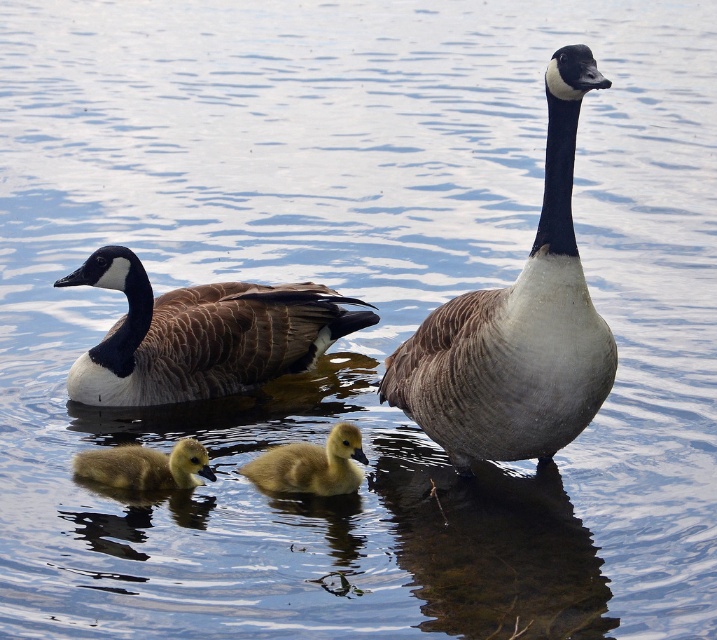
Question: Among these objects, which one is farthest from the camera?

Choices:
 (A) brown feathered goose at left
 (B) golden downy duckling at center
 (C) golden downy duckling at lower left

Answer: (A)

Question: Does matte brown goose at center have a lesser width compared to golden downy duckling at lower left?

Choices:
 (A) no
 (B) yes

Answer: (A)

Question: Which point is farther from the camera taking this photo?

Choices:
 (A) [498, 346]
 (B) [255, 483]

Answer: (B)

Question: Is golden downy duckling at center positioned in front of golden downy duckling at lower left?

Choices:
 (A) no
 (B) yes

Answer: (B)

Question: Which object appears farthest from the camera in this image?

Choices:
 (A) matte brown goose at center
 (B) brown feathered goose at left
 (C) golden downy duckling at center
 (D) golden downy duckling at lower left

Answer: (B)

Question: Where is brown feathered goose at left located in relation to golden downy duckling at lower left in the image?

Choices:
 (A) below
 (B) above

Answer: (B)